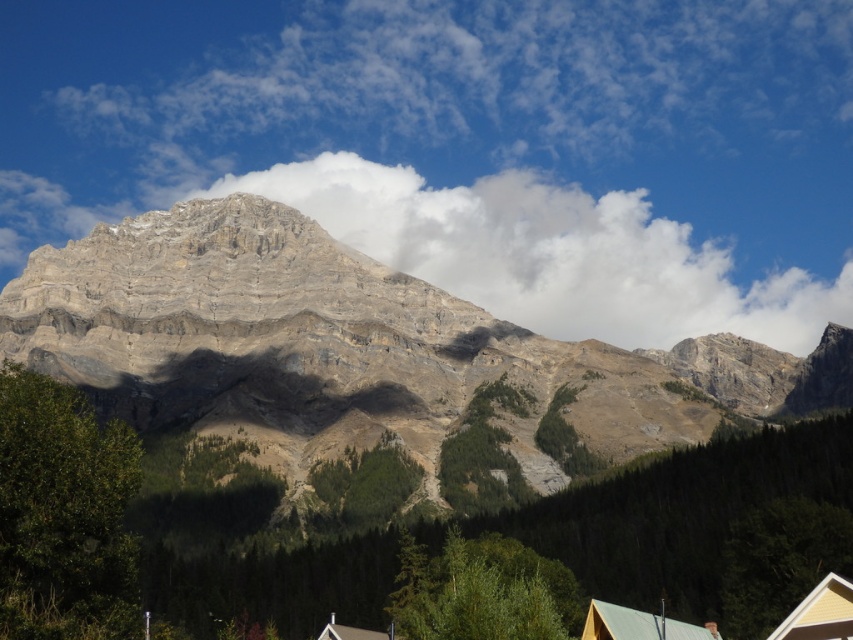
You are an architect designing a new eco lodge. You need to decide whether the brown wooden hut at lower center can be seen from the rocky mountain range at center. Based on their sizes, what would you conclude?

The rocky mountain range at center is bigger than the brown wooden hut at lower center, so the hut might be obscured by the mountain range when viewed from there.

You are a drone operator planning to fly a drone between the rocky mountain range at center and the white fluffy cloud at upper center. The drone has a maximum flight range of 300 feet. Can the drone safely make the trip without running out of battery?

The rocky mountain range at center and white fluffy cloud at upper center are 320.40 feet apart from each other. Since the drone can only fly 300 feet, it cannot safely make the trip as the distance exceeds its maximum range.

You are an airplane passenger looking out the window and see the rocky mountain range at center and the white fluffy cloud at upper center. Which object appears closer to the airplane based on their relative sizes?

The rocky mountain range at center appears closer to the airplane than the white fluffy cloud at upper center because it is taller, suggesting it is nearer to the observer.